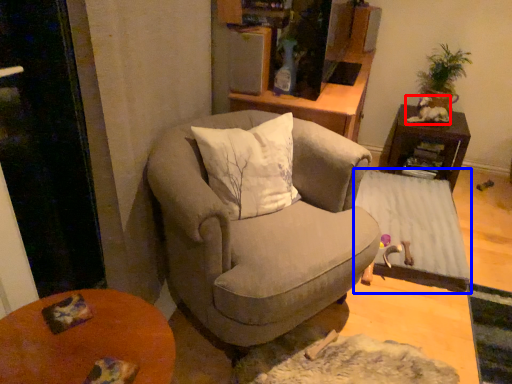
Question: Which object is further to the camera taking this photo, animal (highlighted by a red box) or table (highlighted by a blue box)?

Choices:
 (A) animal
 (B) table

Answer: (A)